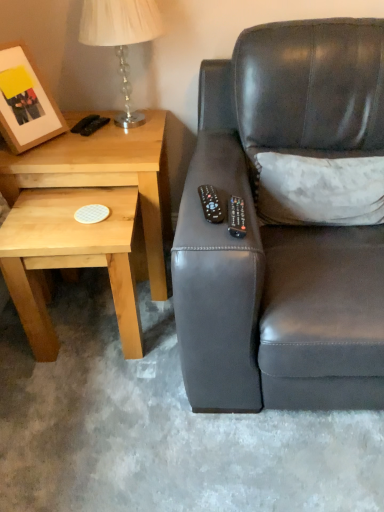
You are a GUI agent. You are given a task and a screenshot of the screen. Output one action in this format:
    pyautogui.click(x=<x>, y=<y>)
    Task: Click on the free spot above light wood/textureobject at left (from a real-world perspective)
    The image size is (384, 512).
    Given the screenshot: What is the action you would take?
    pyautogui.click(x=85, y=139)